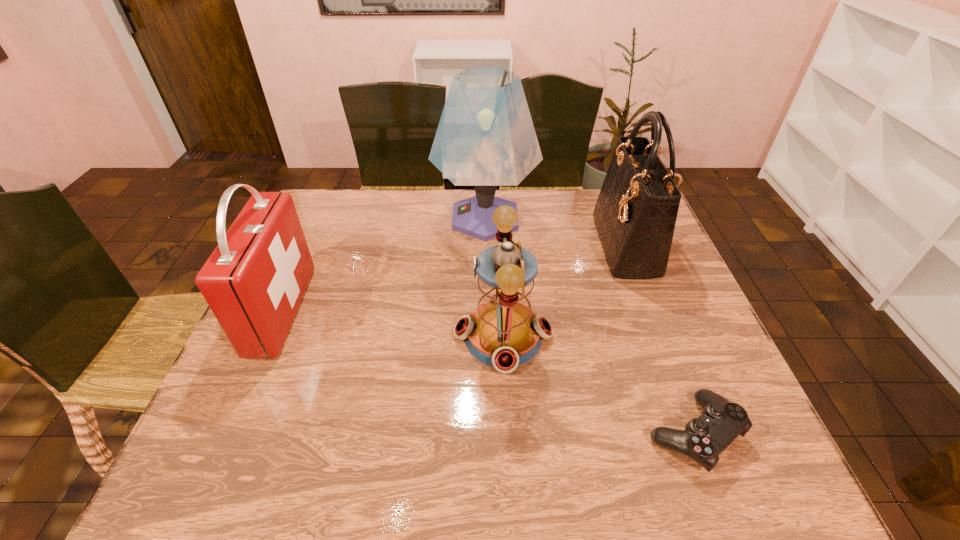
The height and width of the screenshot is (540, 960). I want to click on vacant position located at the front of the handbag with visible charms, so click(577, 246).

Where is `vacant area located 0.080m at the front of the handbag with visible charms`? vacant area located 0.080m at the front of the handbag with visible charms is located at coordinates (574, 246).

The width and height of the screenshot is (960, 540). I want to click on vacant space located on the front face of the first-aid kit, so click(359, 310).

At what (x,y) coordinates should I click in order to perform the action: click on free space located on the front-facing side of the fourth tallest object. Please return your answer as a coordinate pair (x, y). Looking at the image, I should click on (355, 336).

At what (x,y) coordinates should I click in order to perform the action: click on vacant space situated on the front-facing side of the fourth tallest object. Please return your answer as a coordinate pair (x, y). Image resolution: width=960 pixels, height=540 pixels. Looking at the image, I should click on (351, 336).

I want to click on vacant region located on the front-facing side of the fourth tallest object, so click(298, 336).

Locate an element on the screen. vacant space located 0.120m on the back of the nearest object is located at coordinates (662, 350).

At what (x,y) coordinates should I click in order to perform the action: click on lampshade at the far edge. Please return your answer as a coordinate pair (x, y). This screenshot has height=540, width=960. Looking at the image, I should click on click(x=485, y=138).

This screenshot has height=540, width=960. I want to click on handbag present at the far edge, so click(x=635, y=214).

Find the location of a particular element. object at the near edge is located at coordinates (704, 438).